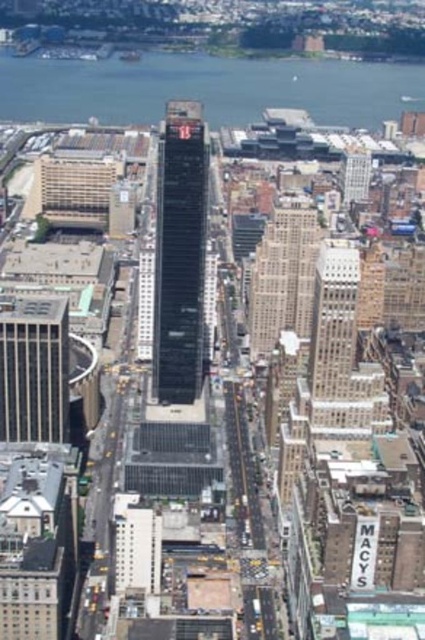
You are a drone operator trying to deliver a package to the black glass building at center. Your current position is at point (180, 253). Can you confirm if you are directly above the black glass building at center?

Yes, since the black glass building at center is located at point (180, 253), you are directly above it.

You are a drone operator trying to navigate between the gray concrete skyscraper at left and the beige stone building at center. Based on their positions, which building should you fly over first to stay above the lower one?

The gray concrete skyscraper at left is located below the beige stone building at center, so you should fly over the gray concrete skyscraper at left first to stay above the lower one.

You are a drone operator who needs to deliver a package from the gray concrete skyscraper at left to the beige stone building at center. The drone has a maximum range of 150 meters. Can the drone complete the delivery without needing a recharge?

The distance between the gray concrete skyscraper at left and the beige stone building at center is 167.65 meters, which exceeds the drone operator stated maximum range of 150 meters. Therefore, the drone cannot complete the delivery without needing a recharge.